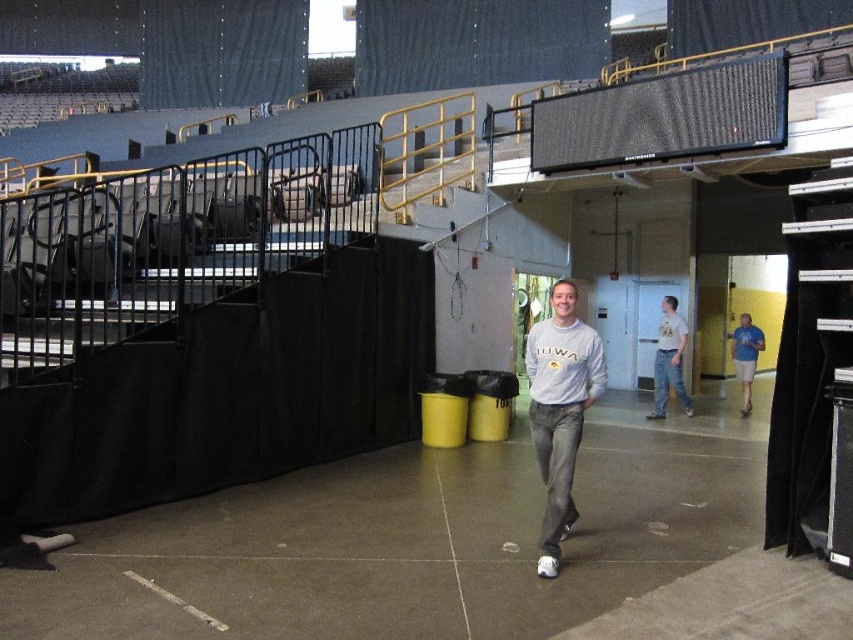
You are an event organizer checking the venue setup. You notice the white cotton shirt at center and the blue fabric shorts at right. Which piece of clothing is closer to you?

The white cotton shirt at center is closer to you because it is in front of the blue fabric shorts at right.

You are a spectator at the event and want to find your friend wearing the gray cotton sweatshirt at center and blue fabric shorts at right. Which piece of clothing is on the left side when looking at them from the front?

The gray cotton sweatshirt at center is positioned on the left side of blue fabric shorts at right, so the sweatshirt is on the left when viewed from the front.

You are a maintenance worker in the arena and you need to walk from the gray cotton sweatshirt at center to the white cotton shirt at center. How many steps would you need to take if each step is 2 feet long?

The distance between the gray cotton sweatshirt at center and the white cotton shirt at center is 20.42 feet. If each step is 2 feet long, you would need approximately 10 steps to cover the distance.